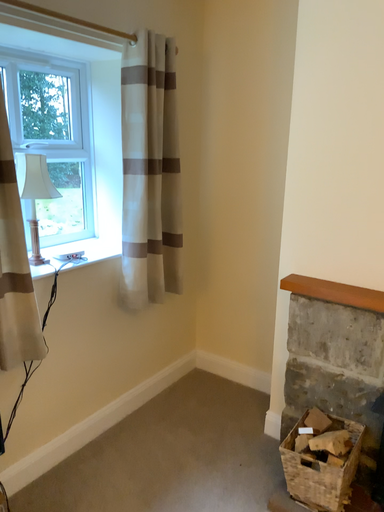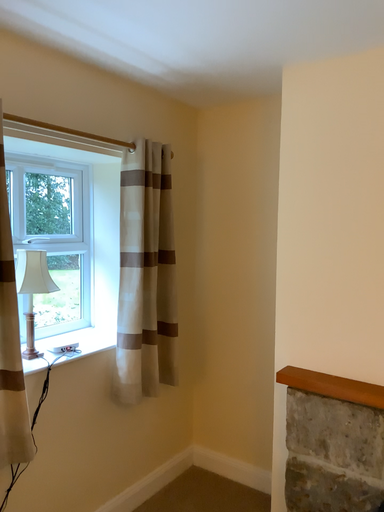
Question: Which way did the camera rotate in the video?

Choices:
 (A) rotated downward
 (B) rotated upward

Answer: (B)